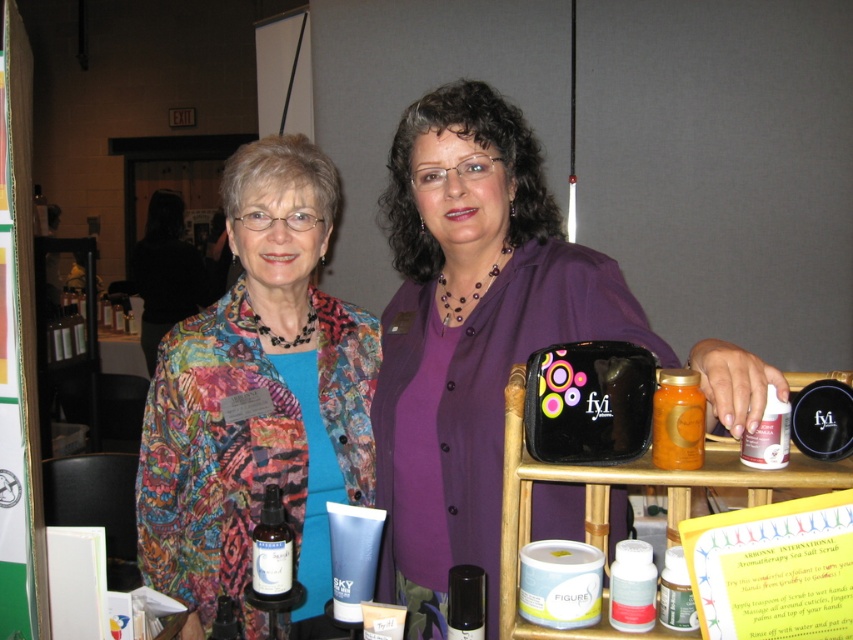
Does multicolored fabric jacket at center appear on the right side of translucent glass spray bottle at center?

In fact, multicolored fabric jacket at center is to the left of translucent glass spray bottle at center.

Measure the distance between multicolored fabric jacket at center and camera.

1.30 meters

Which is behind, point (309, 531) or point (283, 540)?

The point (309, 531) is more distant.

The image size is (853, 640). Find the location of `multicolored fabric jacket at center`. multicolored fabric jacket at center is located at coordinates (258, 394).

Between purple matte shirt at center and translucent glass spray bottle at center, which one appears on the right side from the viewer's perspective?

purple matte shirt at center is more to the right.

Describe the element at coordinates (469, 332) in the screenshot. I see `purple matte shirt at center` at that location.

I want to click on purple matte shirt at center, so click(469, 332).

Which of these two, purple matte shirt at center or multicolored fabric jacket at center, stands shorter?

multicolored fabric jacket at center is shorter.

Is purple matte shirt at center below multicolored fabric jacket at center?

Actually, purple matte shirt at center is above multicolored fabric jacket at center.

Where is `purple matte shirt at center`? purple matte shirt at center is located at coordinates (469, 332).

Where is `purple matte shirt at center`? This screenshot has height=640, width=853. purple matte shirt at center is located at coordinates (469, 332).